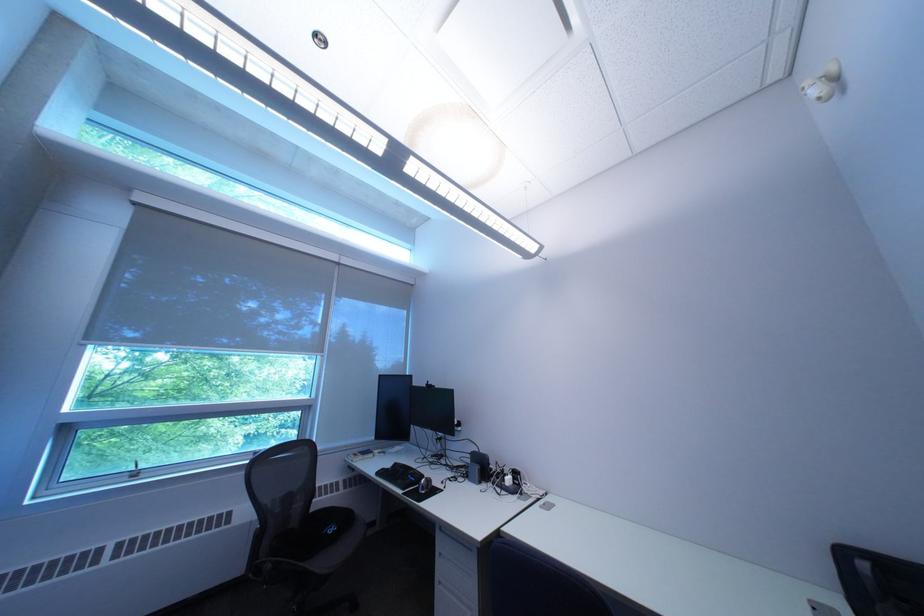
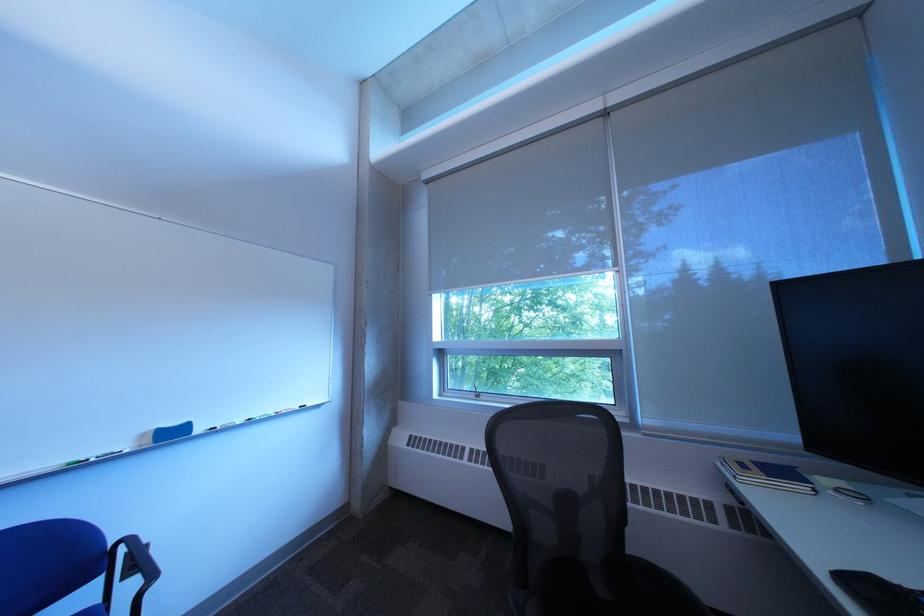
Where in the second image is the point corresponding to the point at 393,475 from the first image?

(860, 582)